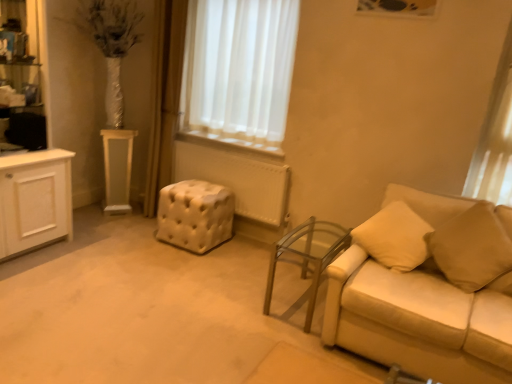
Image resolution: width=512 pixels, height=384 pixels. Describe the element at coordinates (472, 248) in the screenshot. I see `beige fabric pillow at right` at that location.

Where is `beige fabric pillow at right`? The image size is (512, 384). beige fabric pillow at right is located at coordinates (472, 248).

What is the approximate width of beige leather couch at right?

beige leather couch at right is 35.89 inches in width.

This screenshot has height=384, width=512. I want to click on beige fabric pillow at right, so coord(472,248).

Considering the relative sizes of beige leather couch at right and transparent glass table at lower right, the second table from the back, in the image provided, is beige leather couch at right smaller than transparent glass table at lower right, the second table from the back,?

No, beige leather couch at right is not smaller than transparent glass table at lower right, the second table from the back.

Is beige leather couch at right located outside transparent glass table at lower right, which appears as the 1th table when ordered from the bottom?

beige leather couch at right lies outside transparent glass table at lower right, which appears as the 1th table when ordered from the bottom,'s area.

From a real-world perspective, which is physically above, beige leather couch at right or transparent glass table at lower right, which is counted as the second table, starting from the top?

From a 3D spatial view, beige leather couch at right is above.

Between beige leather couch at right and beige fabric pillow at right, which one has smaller width?

With smaller width is beige fabric pillow at right.

From a real-world perspective, is beige leather couch at right above or below beige fabric pillow at right?

Clearly, from a real-world perspective, beige leather couch at right is below beige fabric pillow at right.

From the picture: From the image's perspective, is beige leather couch at right over beige fabric pillow at right?

No.

Is point (398, 314) farther from camera compared to point (490, 234)?

No, it is in front of (490, 234).

Based on their positions, is beige fabric pillow at right located to the left or right of transparent glass table at lower right, marked as the second table in a left-to-right arrangement?

beige fabric pillow at right is to the right of transparent glass table at lower right, marked as the second table in a left-to-right arrangement.

Is the depth of beige fabric pillow at right greater than that of transparent glass table at lower right, the 1th table from the right?

No, beige fabric pillow at right is closer to the camera.

Which is correct: beige fabric pillow at right is inside transparent glass table at lower right, which ranks as the 1th table in front-to-back order, or outside of it?

The correct answer is: outside.

In the image, there is a transparent glass table at lower right, the 1th table from the right. Find the location of `pillow above it (from the image's perspective)`. pillow above it (from the image's perspective) is located at coordinates (472, 248).

From a real-world perspective, is beige fabric pillow at right positioned above or below white glossy pedestal at left, which ranks as the 2th table in front-to-back order?

From a real-world perspective, beige fabric pillow at right is physically above white glossy pedestal at left, which ranks as the 2th table in front-to-back order.

Could white glossy pedestal at left, which is counted as the 1th table, starting from the left, be considered to be inside beige fabric pillow at right?

No, white glossy pedestal at left, which is counted as the 1th table, starting from the left, is not a part of beige fabric pillow at right.

From the image's perspective, relative to white glossy pedestal at left, the first table in the top-to-bottom sequence, is beige fabric pillow at right above or below?

beige fabric pillow at right is situated lower than white glossy pedestal at left, the first table in the top-to-bottom sequence, in the image.

Considering the sizes of objects beige fabric pillow at right and white glossy pedestal at left, placed as the 2th table when sorted from bottom to top, in the image provided, who is smaller, beige fabric pillow at right or white glossy pedestal at left, placed as the 2th table when sorted from bottom to top,?

With smaller size is white glossy pedestal at left, placed as the 2th table when sorted from bottom to top.

Is white glossy pedestal at left, which ranks as the 2th table in front-to-back order, inside or outside of beige fabric pillow at right?

white glossy pedestal at left, which ranks as the 2th table in front-to-back order, is not enclosed by beige fabric pillow at right.

Based on the photo, from a real-world perspective, is white glossy pedestal at left, the first table in the top-to-bottom sequence, positioned above or below beige fabric pillow at right?

white glossy pedestal at left, the first table in the top-to-bottom sequence, is situated lower than beige fabric pillow at right in the real world.

Which is behind, point (119, 147) or point (470, 272)?

The point (119, 147) is farther from the camera.

From a real-world perspective, is white tufted ottoman at center physically below white glossy pedestal at left, which is counted as the 1th table, starting from the left?

Yes, from a real-world perspective, white tufted ottoman at center is beneath white glossy pedestal at left, which is counted as the 1th table, starting from the left.

Is white tufted ottoman at center not within white glossy pedestal at left, placed as the 2th table when sorted from bottom to top?

Yes, white tufted ottoman at center is outside of white glossy pedestal at left, placed as the 2th table when sorted from bottom to top.

Is white tufted ottoman at center positioned behind white glossy pedestal at left, which is counted as the 1th table, starting from the left?

No.

Is beige fabric pillow at right wider or thinner than beige leather couch at right?

beige fabric pillow at right is thinner than beige leather couch at right.

Is beige fabric pillow at right touching beige leather couch at right?

No, beige fabric pillow at right is not in contact with beige leather couch at right.

Who is taller, beige fabric pillow at right or beige leather couch at right?

With more height is beige leather couch at right.

Locate an element on the screen. Image resolution: width=512 pixels, height=384 pixels. studio couch that appears above the transparent glass table at lower right, which ranks as the 1th table in front-to-back order (from a real-world perspective) is located at coordinates click(x=419, y=320).

Locate an element on the screen. pillow lying behind the beige leather couch at right is located at coordinates (472, 248).

Looking at the image, which one is located closer to white glossy pedestal at left, the first table in the top-to-bottom sequence, transparent glass table at lower right, which ranks as the 1th table in front-to-back order, or beige leather couch at right?

Based on the image, transparent glass table at lower right, which ranks as the 1th table in front-to-back order, appears to be nearer to white glossy pedestal at left, the first table in the top-to-bottom sequence.

From the image, which object appears to be nearer to transparent glass table at lower right, the 1th table from the right, beige fabric pillow at right or beige leather couch at right?

The object closer to transparent glass table at lower right, the 1th table from the right, is beige leather couch at right.

Which object lies further to the anchor point beige leather couch at right, beige fabric pillow at right or white tufted ottoman at center?

white tufted ottoman at center.

When comparing their distances from transparent glass table at lower right, which ranks as the 1th table in front-to-back order, does white tufted ottoman at center or beige leather couch at right seem closer?

The object closer to transparent glass table at lower right, which ranks as the 1th table in front-to-back order, is beige leather couch at right.

From the image, which object appears to be nearer to white tufted ottoman at center, transparent glass table at lower right, the second table from the back, or white glossy pedestal at left, placed as the 2th table when sorted from bottom to top?

transparent glass table at lower right, the second table from the back.

Looking at the image, which one is located closer to beige fabric pillow at right, white glossy pedestal at left, placed as the 2th table when sorted from bottom to top, or beige leather couch at right?

beige leather couch at right is positioned closer to the anchor beige fabric pillow at right.

Looking at the image, which one is located closer to transparent glass table at lower right, which appears as the 1th table when ordered from the bottom, white tufted ottoman at center or beige fabric pillow at right?

The object closer to transparent glass table at lower right, which appears as the 1th table when ordered from the bottom, is beige fabric pillow at right.

When comparing their distances from white tufted ottoman at center, does white glossy pedestal at left, which ranks as the 2th table in front-to-back order, or transparent glass table at lower right, which ranks as the 1th table in front-to-back order, seem further?

white glossy pedestal at left, which ranks as the 2th table in front-to-back order.

Where is `table between white tufted ottoman at center and beige leather couch at right in the horizontal direction`? table between white tufted ottoman at center and beige leather couch at right in the horizontal direction is located at coordinates 308,256.

At what (x,y) coordinates should I click in order to perform the action: click on stool between white glossy pedestal at left, the first table in the top-to-bottom sequence, and beige leather couch at right from left to right. Please return your answer as a coordinate pair (x, y). The height and width of the screenshot is (384, 512). Looking at the image, I should click on (195, 215).

You are a GUI agent. You are given a task and a screenshot of the screen. Output one action in this format:
    pyautogui.click(x=<x>, y=<y>)
    Task: Click on the studio couch located between white tufted ottoman at center and beige fabric pillow at right in the left-right direction
    
    Given the screenshot: What is the action you would take?
    pyautogui.click(x=419, y=320)

Where is `table between white tufted ottoman at center and beige fabric pillow at right`? table between white tufted ottoman at center and beige fabric pillow at right is located at coordinates (308, 256).